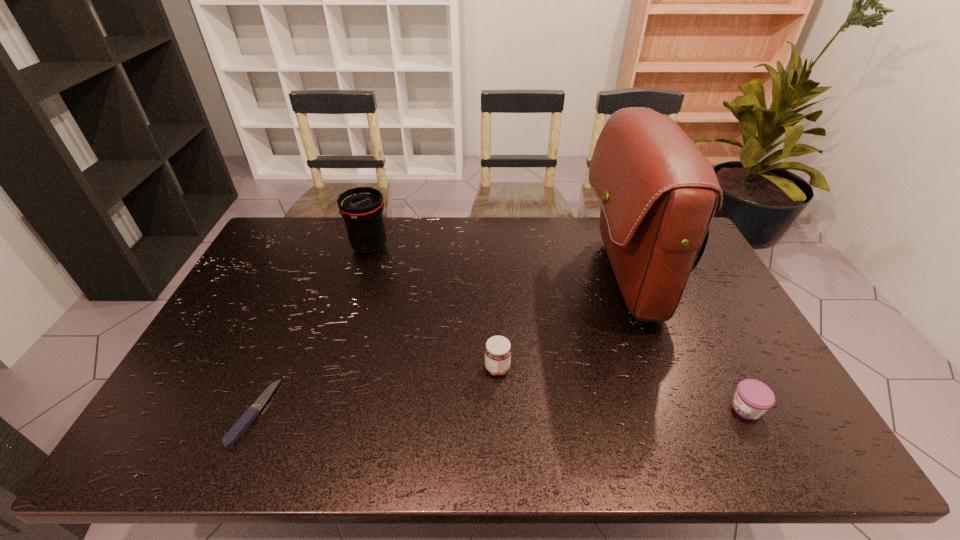
Find the location of a particular element. The width and height of the screenshot is (960, 540). telephoto lens positioned at the far edge is located at coordinates (361, 207).

The width and height of the screenshot is (960, 540). I want to click on object positioned at the near edge, so click(239, 428).

Where is `object that is positioned at the right edge`? object that is positioned at the right edge is located at coordinates [752, 399].

Where is `blank area at the far edge`? The height and width of the screenshot is (540, 960). blank area at the far edge is located at coordinates (388, 227).

In the image, there is a desktop. At what (x,y) coordinates should I click in order to perform the action: click on vacant region at the near edge. Please return your answer as a coordinate pair (x, y). The image size is (960, 540). Looking at the image, I should click on (620, 427).

You are a GUI agent. You are given a task and a screenshot of the screen. Output one action in this format:
    pyautogui.click(x=<x>, y=<y>)
    Task: Click on the vacant area at the left edge
    
    Given the screenshot: What is the action you would take?
    click(x=220, y=353)

At what (x,y) coordinates should I click in order to perform the action: click on vacant space at the far left corner of the desktop. Please return your answer as a coordinate pair (x, y). Looking at the image, I should click on (305, 235).

At what (x,y) coordinates should I click in order to perform the action: click on vacant space that's between the satchel and the right jam. Please return your answer as a coordinate pair (x, y). This screenshot has width=960, height=540. Looking at the image, I should click on (685, 343).

At what (x,y) coordinates should I click in order to perform the action: click on vacant area that lies between the third farthest object and the satchel. Please return your answer as a coordinate pair (x, y). The image size is (960, 540). Looking at the image, I should click on (561, 323).

The image size is (960, 540). I want to click on unoccupied position between the second object from left to right and the shortest object, so click(311, 330).